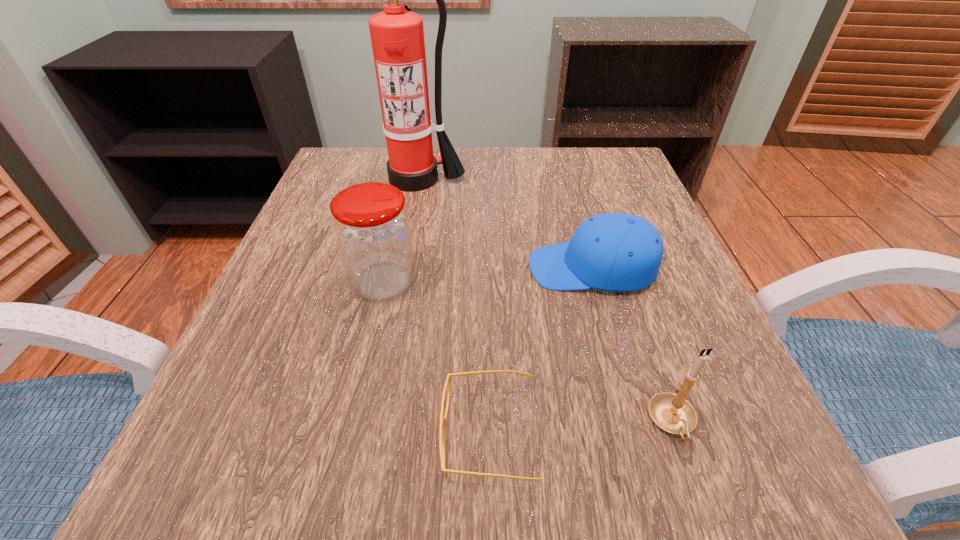
Locate an element on the screen. the tallest object is located at coordinates (397, 36).

Locate an element on the screen. the farthest object is located at coordinates (397, 36).

Where is `jar`? The height and width of the screenshot is (540, 960). jar is located at coordinates [x=372, y=228].

Locate an element on the screen. the third shortest object is located at coordinates tap(671, 412).

Find the location of a particular element. cap is located at coordinates (619, 252).

Image resolution: width=960 pixels, height=540 pixels. Identify the location of spectacles. (442, 418).

Locate an element on the screen. The image size is (960, 540). free point located at the nozzle of the farthest object is located at coordinates (407, 232).

Locate an element on the screen. vacant position located on the front of the jar is located at coordinates (343, 460).

Find the location of a particular element. The width and height of the screenshot is (960, 540). vacant region located on the front-facing side of the second shortest object is located at coordinates (447, 268).

The width and height of the screenshot is (960, 540). Identify the location of free space located on the front-facing side of the second shortest object. coord(333,268).